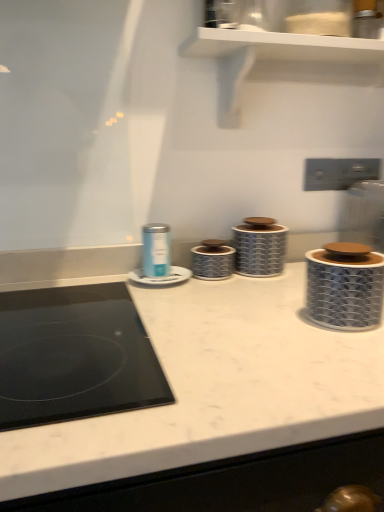
Question: From a real-world perspective, is matte blue canister at center, which is counted as the 1th appliance, starting from the left, under silver textured canister at center, which is counted as the third appliance, starting from the right?

Choices:
 (A) yes
 (B) no

Answer: (B)

Question: Is matte blue canister at center, arranged as the fifth appliance when viewed from the right, wider than silver textured canister at center, the 3th appliance viewed from the left?

Choices:
 (A) no
 (B) yes

Answer: (A)

Question: Is matte blue canister at center, which is counted as the 1th appliance, starting from the left, outside of silver textured canister at center, the 3th appliance viewed from the left?

Choices:
 (A) yes
 (B) no

Answer: (A)

Question: Are matte blue canister at center, which is counted as the 1th appliance, starting from the left, and silver textured canister at center, the 3th appliance viewed from the left, far apart?

Choices:
 (A) yes
 (B) no

Answer: (B)

Question: Considering the relative sizes of matte blue canister at center, which is counted as the 1th appliance, starting from the left, and silver textured canister at center, the 3th appliance viewed from the left, in the image provided, is matte blue canister at center, which is counted as the 1th appliance, starting from the left, taller than silver textured canister at center, the 3th appliance viewed from the left,?

Choices:
 (A) yes
 (B) no

Answer: (A)

Question: Is matte blue canister at center, arranged as the fifth appliance when viewed from the right, at the right side of silver textured canister at center, the 3th appliance viewed from the left?

Choices:
 (A) no
 (B) yes

Answer: (A)

Question: Is matte blue canister at center, arranged as the fifth appliance when viewed from the right, at the right side of blue and white ceramic canister at center, the second appliance when ordered from right to left?

Choices:
 (A) no
 (B) yes

Answer: (A)

Question: Is matte blue canister at center, arranged as the fifth appliance when viewed from the right, aimed at blue and white ceramic canister at center, which appears as the fourth appliance when viewed from the left?

Choices:
 (A) no
 (B) yes

Answer: (A)

Question: From a real-world perspective, is matte blue canister at center, arranged as the fifth appliance when viewed from the right, located beneath blue and white ceramic canister at center, which appears as the fourth appliance when viewed from the left?

Choices:
 (A) no
 (B) yes

Answer: (A)

Question: Can you confirm if matte blue canister at center, which is counted as the 1th appliance, starting from the left, is shorter than blue and white ceramic canister at center, the second appliance when ordered from right to left?

Choices:
 (A) no
 (B) yes

Answer: (B)

Question: Considering the relative sizes of matte blue canister at center, arranged as the fifth appliance when viewed from the right, and blue and white ceramic canister at center, the second appliance when ordered from right to left, in the image provided, is matte blue canister at center, arranged as the fifth appliance when viewed from the right, smaller than blue and white ceramic canister at center, the second appliance when ordered from right to left,?

Choices:
 (A) yes
 (B) no

Answer: (A)

Question: Is the position of matte blue canister at center, which is counted as the 1th appliance, starting from the left, less distant than that of blue and white ceramic canister at center, which appears as the fourth appliance when viewed from the left?

Choices:
 (A) yes
 (B) no

Answer: (A)

Question: From the image's perspective, does matte blue canister at center, acting as the 4th appliance starting from the right, appear higher than matte blue canister at center, which is counted as the 1th appliance, starting from the left?

Choices:
 (A) yes
 (B) no

Answer: (B)